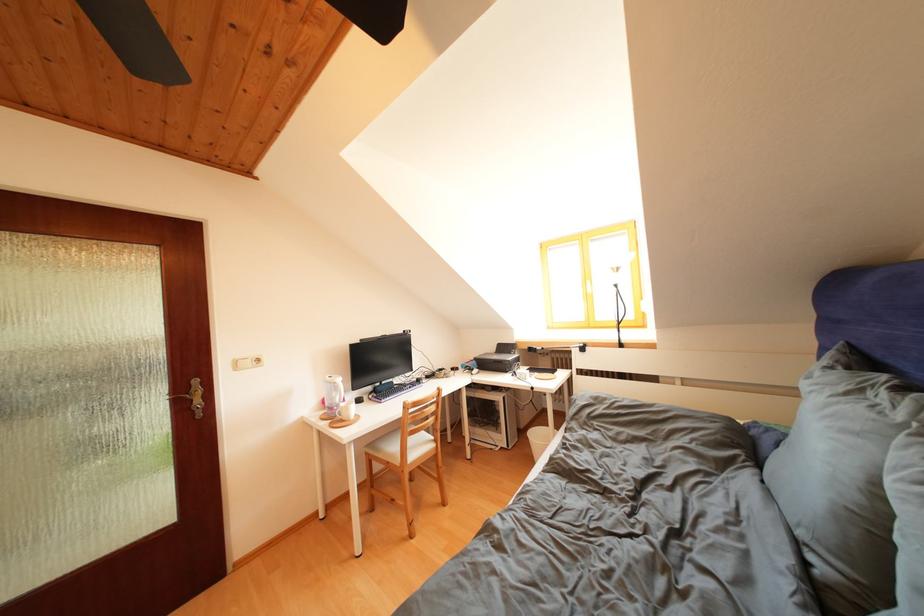
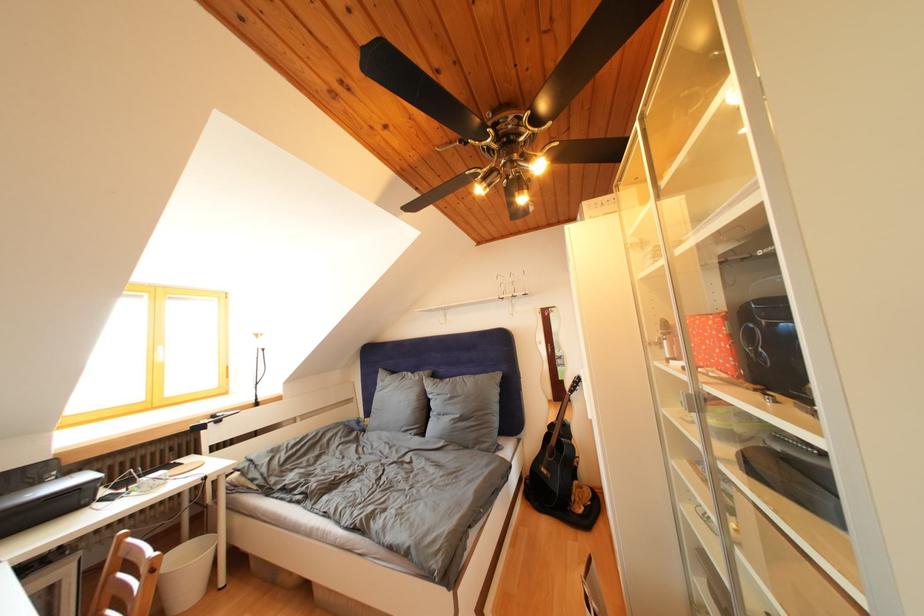
The point at (517, 358) is marked in the first image. Where is the corresponding point in the second image?

(44, 488)